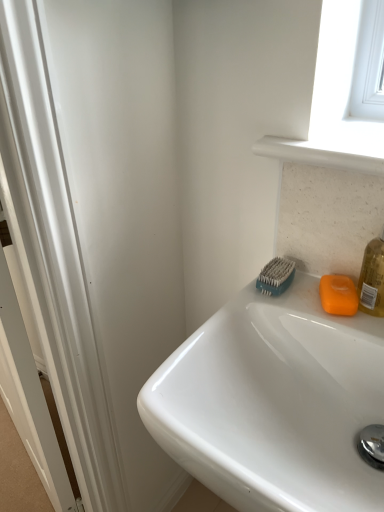
Question: Is teal rubber brush at upper right oriented towards orange matte soap at right?

Choices:
 (A) no
 (B) yes

Answer: (A)

Question: Does teal rubber brush at upper right come in front of orange matte soap at right?

Choices:
 (A) yes
 (B) no

Answer: (B)

Question: Can you confirm if teal rubber brush at upper right is bigger than orange matte soap at right?

Choices:
 (A) no
 (B) yes

Answer: (B)

Question: From the image's perspective, does teal rubber brush at upper right appear lower than orange matte soap at right?

Choices:
 (A) yes
 (B) no

Answer: (B)

Question: Considering the relative sizes of teal rubber brush at upper right and orange matte soap at right in the image provided, is teal rubber brush at upper right thinner than orange matte soap at right?

Choices:
 (A) yes
 (B) no

Answer: (A)

Question: Is teal rubber brush at upper right to the left of orange matte soap at right from the viewer's perspective?

Choices:
 (A) yes
 (B) no

Answer: (A)

Question: Is orange matte soap at right next to white glossy sink at upper right?

Choices:
 (A) yes
 (B) no

Answer: (B)

Question: From the image's perspective, is orange matte soap at right above white glossy sink at upper right?

Choices:
 (A) no
 (B) yes

Answer: (B)

Question: Is orange matte soap at right facing towards white glossy sink at upper right?

Choices:
 (A) yes
 (B) no

Answer: (A)

Question: Is white glossy sink at upper right at the back of orange matte soap at right?

Choices:
 (A) no
 (B) yes

Answer: (B)

Question: Considering the relative sizes of orange matte soap at right and white glossy sink at upper right in the image provided, is orange matte soap at right wider than white glossy sink at upper right?

Choices:
 (A) yes
 (B) no

Answer: (B)

Question: Is orange matte soap at right positioned behind white glossy sink at upper right?

Choices:
 (A) yes
 (B) no

Answer: (A)

Question: From a real-world perspective, is white glossy sink at upper right under orange matte soap at right?

Choices:
 (A) no
 (B) yes

Answer: (B)